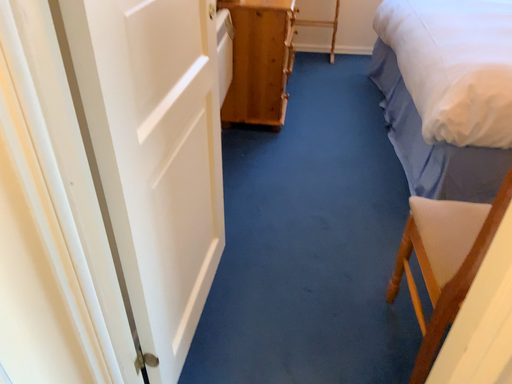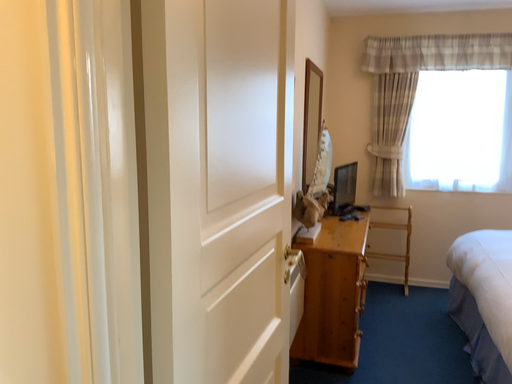
Question: How did the camera likely rotate when shooting the video?

Choices:
 (A) rotated downward
 (B) rotated upward

Answer: (B)